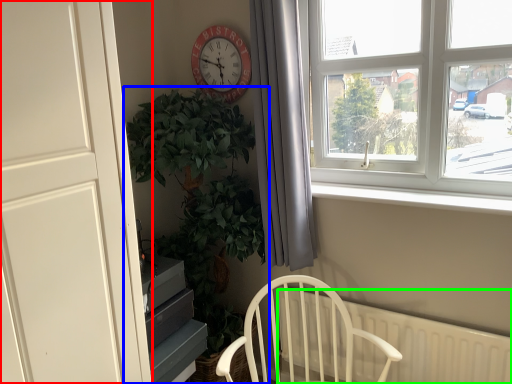
Question: Considering the real-world distances, which object is closest to door (highlighted by a red box)? houseplant (highlighted by a blue box) or radiator (highlighted by a green box).

Choices:
 (A) houseplant
 (B) radiator

Answer: (A)